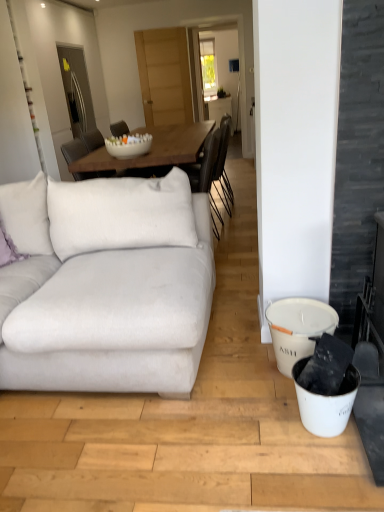
Measure the distance between white fabric couch at left and camera.

white fabric couch at left is 5.53 feet from camera.

In order to face purple velvet pillow at left, should I rotate leftwards or rightwards?

To align with it, rotate left about 24.922°.

Locate an element on the screen. white matte bucket at lower right is located at coordinates (297, 328).

What do you see at coordinates (128, 145) in the screenshot? I see `white glossy bowl at center` at bounding box center [128, 145].

The image size is (384, 512). In order to click on white fabric couch at left in this screenshot , I will do `click(113, 290)`.

From the image's perspective, is white matte bucket at lower right above or below white fabric couch at left?

white matte bucket at lower right is below white fabric couch at left.

Considering the relative positions of white matte bucket at lower right and white fabric couch at left in the image provided, is white matte bucket at lower right to the left of white fabric couch at left from the viewer's perspective?

In fact, white matte bucket at lower right is to the right of white fabric couch at left.

Considering the sizes of white matte bucket at lower right and white fabric couch at left in the image, is white matte bucket at lower right taller or shorter than white fabric couch at left?

Considering their sizes, white matte bucket at lower right has less height than white fabric couch at left.

Can we say white glossy bowl at center lies outside white matte bucket at lower right?

Yes, white glossy bowl at center is outside of white matte bucket at lower right.

Does white glossy bowl at center turn towards white matte bucket at lower right?

No, white glossy bowl at center is not facing towards white matte bucket at lower right.

Locate an element on the screen. bowl that is above the white matte bucket at lower right (from a real-world perspective) is located at coordinates point(128,145).

Which object is thinner, white glossy bowl at center or white matte bucket at lower right?

With smaller width is white matte bucket at lower right.

Which object is further away from the camera, purple velvet pillow at left or white fabric couch at left?

purple velvet pillow at left is further away from the camera.

Looking at this image, from a real-world perspective, is purple velvet pillow at left under white fabric couch at left?

No, from a real-world perspective, purple velvet pillow at left is not below white fabric couch at left.

Between purple velvet pillow at left and white fabric couch at left, which one has more height?

white fabric couch at left.

Which is farther, (185, 342) or (144, 142)?

The point (144, 142) is more distant.

Does white fabric couch at left touch white glossy bowl at center?

No, white fabric couch at left is not in contact with white glossy bowl at center.

Relative to white glossy bowl at center, is white fabric couch at left in front or behind?

white fabric couch at left is positioned closer to the viewer than white glossy bowl at center.

Which is nearer, [299,316] or [127,151]?

Point [299,316].

From a real-world perspective, is white matte bucket at lower right beneath white glossy bowl at center?

Yes.

Looking at this image, looking at their sizes, would you say white matte bucket at lower right is wider or thinner than white glossy bowl at center?

Considering their sizes, white matte bucket at lower right looks slimmer than white glossy bowl at center.

Which of these two, white matte bucket at lower right or white glossy bowl at center, is smaller?

white glossy bowl at center is smaller.

Is point (128, 136) closer to viewer compared to point (7, 240)?

No, (128, 136) is further to viewer.

You are a GUI agent. You are given a task and a screenshot of the screen. Output one action in this format:
    pyautogui.click(x=<x>, y=<y>)
    Task: Click on the bowl on the right of purple velvet pillow at left
    
    Given the screenshot: What is the action you would take?
    pyautogui.click(x=128, y=145)

From the image's perspective, is white glossy bowl at center located beneath purple velvet pillow at left?

No, from the image's perspective, white glossy bowl at center is not beneath purple velvet pillow at left.

Is white glossy bowl at center located outside purple velvet pillow at left?

Yes, white glossy bowl at center is outside of purple velvet pillow at left.

Where is `bowl on the right side of purple velvet pillow at left`? bowl on the right side of purple velvet pillow at left is located at coordinates (128, 145).

Is purple velvet pillow at left facing away from white glossy bowl at center?

No, purple velvet pillow at left is not facing the opposite direction of white glossy bowl at center.

Does point (2, 226) lie in front of point (145, 136)?

Yes.

Is purple velvet pillow at left not close to white glossy bowl at center?

Yes.

At what (x,y) coordinates should I click in order to perform the action: click on studio couch positioned vertically above the white matte bucket at lower right (from a real-world perspective). Please return your answer as a coordinate pair (x, y). Looking at the image, I should click on (113, 290).

Find the location of a particular element. This screenshot has height=512, width=384. bowl located behind the white matte bucket at lower right is located at coordinates (128, 145).

From the image, which object appears to be farther from purple velvet pillow at left, white fabric couch at left or white matte bucket at lower right?

white matte bucket at lower right lies further to purple velvet pillow at left than the other object.

Based on their spatial positions, is purple velvet pillow at left or white fabric couch at left closer to white glossy bowl at center?

purple velvet pillow at left.

Consider the image. Estimate the real-world distances between objects in this image. Which object is further from white matte bucket at lower right, white glossy bowl at center or purple velvet pillow at left?

white glossy bowl at center lies further to white matte bucket at lower right than the other object.

Considering their positions, is white matte bucket at lower right positioned closer to white glossy bowl at center than purple velvet pillow at left?

purple velvet pillow at left.

Estimate the real-world distances between objects in this image. Which object is closer to white glossy bowl at center, white matte bucket at lower right or white fabric couch at left?

Among the two, white fabric couch at left is located nearer to white glossy bowl at center.

Based on their spatial positions, is white matte bucket at lower right or white glossy bowl at center closer to purple velvet pillow at left?

white glossy bowl at center is positioned closer to the anchor purple velvet pillow at left.

Based on their spatial positions, is white matte bucket at lower right or white fabric couch at left further from purple velvet pillow at left?

Among the two, white matte bucket at lower right is located further to purple velvet pillow at left.

Based on their spatial positions, is white glossy bowl at center or white fabric couch at left further from white matte bucket at lower right?

white glossy bowl at center.

Where is `bowl between purple velvet pillow at left and white matte bucket at lower right`? This screenshot has height=512, width=384. bowl between purple velvet pillow at left and white matte bucket at lower right is located at coordinates (128, 145).

This screenshot has height=512, width=384. Find the location of `studio couch situated between purple velvet pillow at left and white matte bucket at lower right from left to right`. studio couch situated between purple velvet pillow at left and white matte bucket at lower right from left to right is located at coordinates (113, 290).

Identify the location of pillow positioned between white fabric couch at left and white glossy bowl at center from near to far. (8, 249).

The image size is (384, 512). In order to click on bucket between white fabric couch at left and white glossy bowl at center from front to back in this screenshot , I will do `click(297, 328)`.